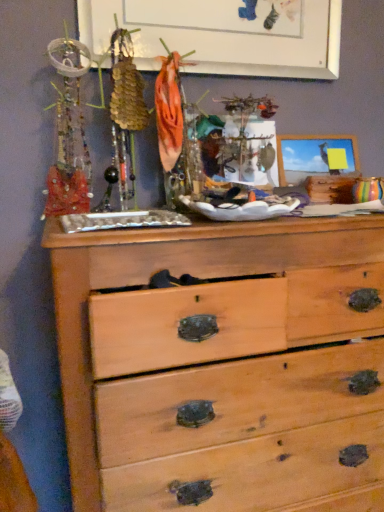
I want to click on natural wood chest of drawers at center, so click(175, 275).

Describe the element at coordinates (175, 275) in the screenshot. I see `natural wood chest of drawers at center` at that location.

This screenshot has height=512, width=384. What are the coordinates of `white matte bulletin board at upper center` in the screenshot? It's located at (225, 34).

The height and width of the screenshot is (512, 384). What do you see at coordinates (225, 34) in the screenshot? I see `white matte bulletin board at upper center` at bounding box center [225, 34].

Measure the distance between white matte bulletin board at upper center and camera.

They are 1.23 meters apart.

At what (x,y) coordinates should I click in order to perform the action: click on natural wood chest of drawers at center. Please return your answer as a coordinate pair (x, y). This screenshot has height=512, width=384. Looking at the image, I should click on (175, 275).

Visually, is white matte bulletin board at upper center positioned to the left or to the right of natural wood chest of drawers at center?

white matte bulletin board at upper center is to the left of natural wood chest of drawers at center.

Considering the relative positions of white matte bulletin board at upper center and natural wood chest of drawers at center in the image provided, is white matte bulletin board at upper center behind natural wood chest of drawers at center?

Yes, white matte bulletin board at upper center is further from the camera.

Is point (192, 40) farther from viewer compared to point (58, 246)?

Yes, it is behind point (58, 246).

From the image's perspective, relative to natural wood chest of drawers at center, is white matte bulletin board at upper center above or below?

white matte bulletin board at upper center is situated higher than natural wood chest of drawers at center in the image.

From a real-world perspective, does white matte bulletin board at upper center stand above natural wood chest of drawers at center?

Yes.

Does white matte bulletin board at upper center have a greater width compared to natural wood chest of drawers at center?

No.

Considering the relative sizes of white matte bulletin board at upper center and natural wood chest of drawers at center in the image provided, is white matte bulletin board at upper center shorter than natural wood chest of drawers at center?

Yes.

Which of these two, white matte bulletin board at upper center or natural wood chest of drawers at center, is bigger?

Bigger between the two is natural wood chest of drawers at center.

Is white matte bulletin board at upper center inside the boundaries of natural wood chest of drawers at center, or outside?

white matte bulletin board at upper center is spatially situated outside natural wood chest of drawers at center.

Is white matte bulletin board at upper center next to natural wood chest of drawers at center and touching it?

No, white matte bulletin board at upper center is not beside natural wood chest of drawers at center.

Is natural wood chest of drawers at center at the back of white matte bulletin board at upper center?

No, white matte bulletin board at upper center is not facing away from natural wood chest of drawers at center.

What's the angular difference between white matte bulletin board at upper center and natural wood chest of drawers at center's facing directions?

The angle between the facing direction of white matte bulletin board at upper center and the facing direction of natural wood chest of drawers at center is 1.62 degrees.

Locate an element on the screen. The image size is (384, 512). chest of drawers on the right of white matte bulletin board at upper center is located at coordinates (175, 275).

Based on their positions, is natural wood chest of drawers at center located to the left or right of white matte bulletin board at upper center?

Clearly, natural wood chest of drawers at center is on the right of white matte bulletin board at upper center in the image.

In the image, is natural wood chest of drawers at center positioned in front of or behind white matte bulletin board at upper center?

natural wood chest of drawers at center is in front of white matte bulletin board at upper center.

Does point (321, 255) appear closer or farther from the camera than point (114, 12)?

Point (321, 255) is positioned closer to the camera compared to point (114, 12).

From the picture: From the image's perspective, is natural wood chest of drawers at center above or below white matte bulletin board at upper center?

Based on their image positions, natural wood chest of drawers at center is located beneath white matte bulletin board at upper center.

From a real-world perspective, who is located lower, natural wood chest of drawers at center or white matte bulletin board at upper center?

From a 3D spatial view, natural wood chest of drawers at center is below.

Between natural wood chest of drawers at center and white matte bulletin board at upper center, which one has smaller width?

white matte bulletin board at upper center.

Which of these two, natural wood chest of drawers at center or white matte bulletin board at upper center, stands taller?

Standing taller between the two is natural wood chest of drawers at center.

Considering the sizes of objects natural wood chest of drawers at center and white matte bulletin board at upper center in the image provided, who is bigger, natural wood chest of drawers at center or white matte bulletin board at upper center?

natural wood chest of drawers at center.

Can white matte bulletin board at upper center be found inside natural wood chest of drawers at center?

No, white matte bulletin board at upper center is located outside of natural wood chest of drawers at center.

Is natural wood chest of drawers at center in contact with white matte bulletin board at upper center?

No, natural wood chest of drawers at center is not next to white matte bulletin board at upper center.

Does natural wood chest of drawers at center turn towards white matte bulletin board at upper center?

No, natural wood chest of drawers at center is not aimed at white matte bulletin board at upper center.

How different are the orientations of natural wood chest of drawers at center and white matte bulletin board at upper center in degrees?

The facing directions of natural wood chest of drawers at center and white matte bulletin board at upper center are 1.62 degrees apart.

Find the location of `bulletin board above the natural wood chest of drawers at center (from a real-world perspective)`. bulletin board above the natural wood chest of drawers at center (from a real-world perspective) is located at coordinates (225, 34).

In order to click on the chest of drawers located underneath the white matte bulletin board at upper center (from a real-world perspective) in this screenshot , I will do `click(175, 275)`.

Where is `bulletin board on the left of natural wood chest of drawers at center`? This screenshot has height=512, width=384. bulletin board on the left of natural wood chest of drawers at center is located at coordinates (225, 34).